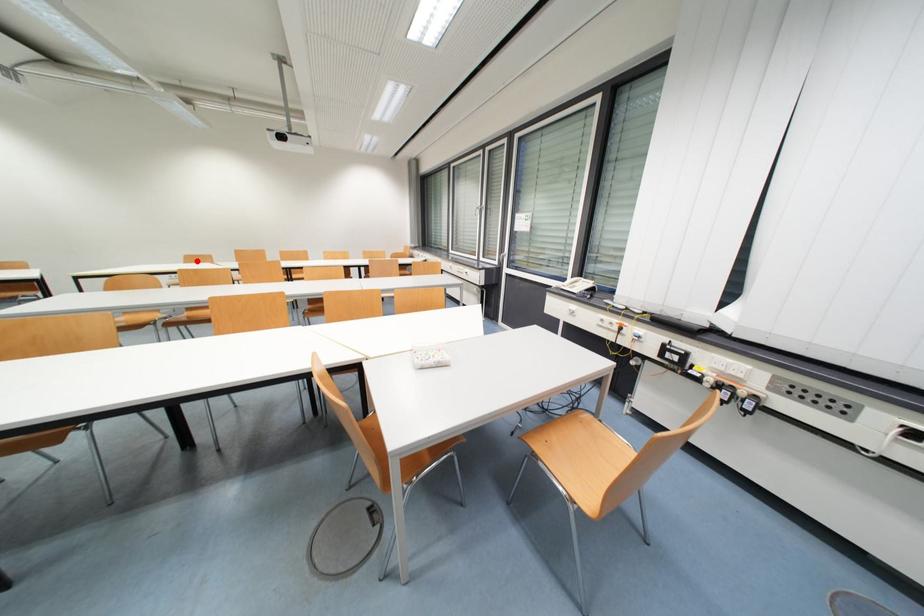
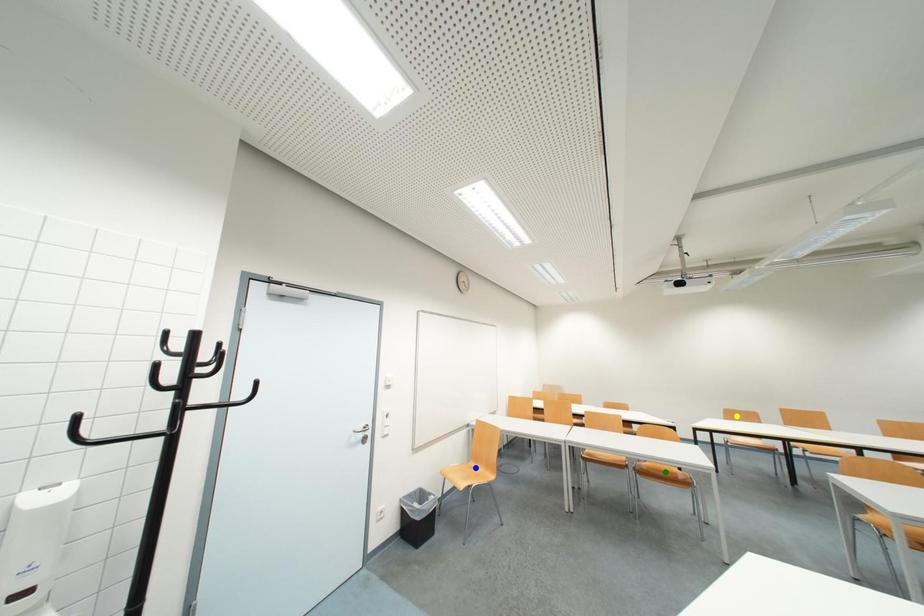
Question: I am providing you with two images of the same scene from different viewpoints. A red point is marked on the first image. You are given multiple points on the second image. Can you choose the point in image 2 that corresponds to the point in image 1?

Choices:
 (A) blue point
 (B) green point
 (C) yellow point

Answer: (C)